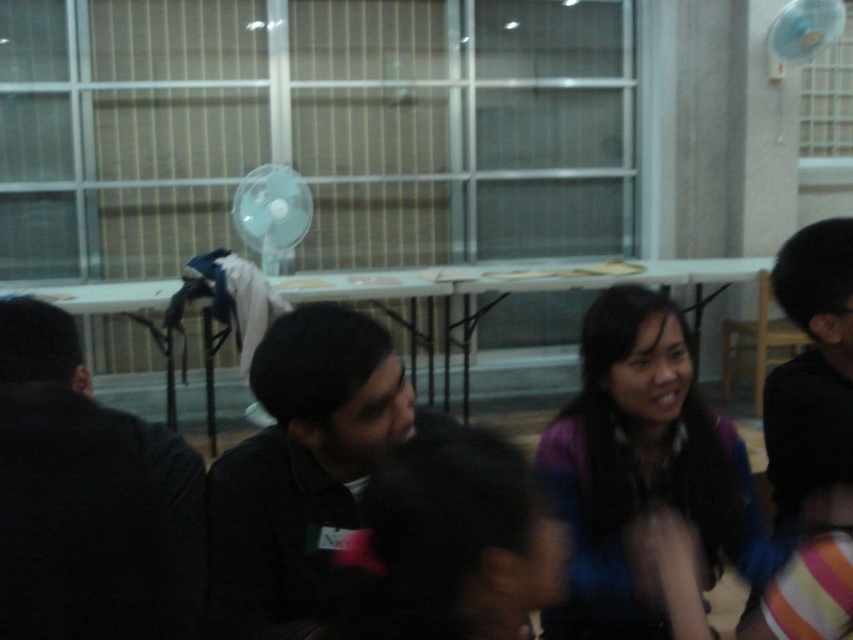
You are organizing a small event and need to decide which item to move first. The multicolored fabric at center and the black matte shirt at center are both on the table. Which item takes up more space on the table?

The multicolored fabric at center has a larger size compared to the black matte shirt at center, so it takes up more space on the table.

You are standing in the room and want to place a small plant between the black matte shirt at center and the white plastic fan at upper center. Which object should you place the plant closer to if you want it to be closer to the fan?

The plant should be placed closer to the white plastic fan at upper center because the black matte shirt at center is to the right of the fan, so the fan is to the left of the shirt. Therefore, placing the plant near the fan side would position it closer to the fan.